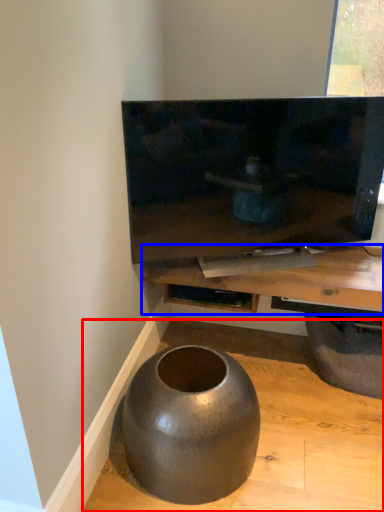
Question: Which point is further to the camera, concrete (highlighted by a red box) or table (highlighted by a blue box)?

Choices:
 (A) concrete
 (B) table

Answer: (B)